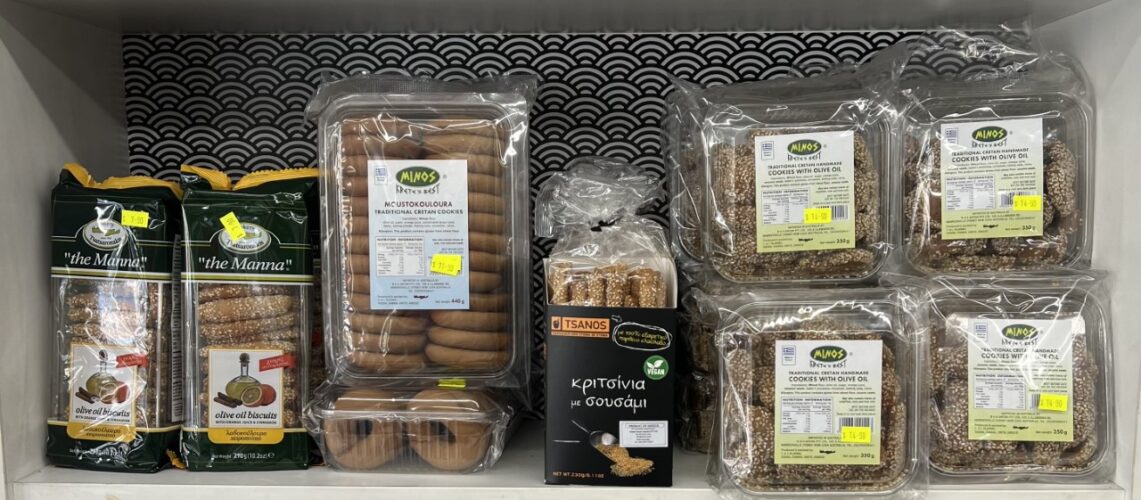
This screenshot has height=500, width=1141. I want to click on snack containers, so click(x=140, y=355), click(x=240, y=348), click(x=387, y=289), click(x=410, y=410), click(x=575, y=384), click(x=777, y=212), click(x=1005, y=184), click(x=815, y=398), click(x=1009, y=389).